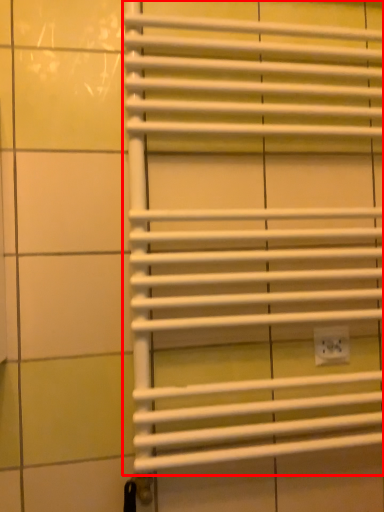
Question: From the image, what is the correct spatial relationship of window blind (annotated by the red box) in relation to electric outlet?

Choices:
 (A) left
 (B) right

Answer: (A)